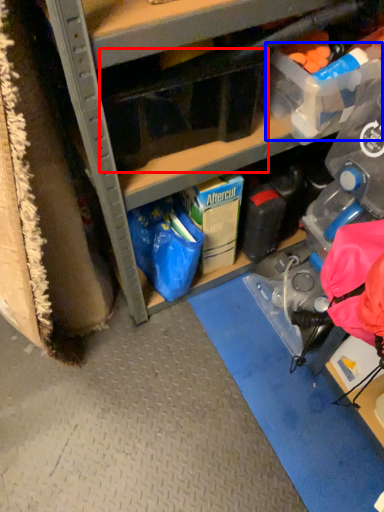
Question: Which object is closer to the camera taking this photo, storage box (highlighted by a red box) or storage box (highlighted by a blue box)?

Choices:
 (A) storage box
 (B) storage box

Answer: (A)